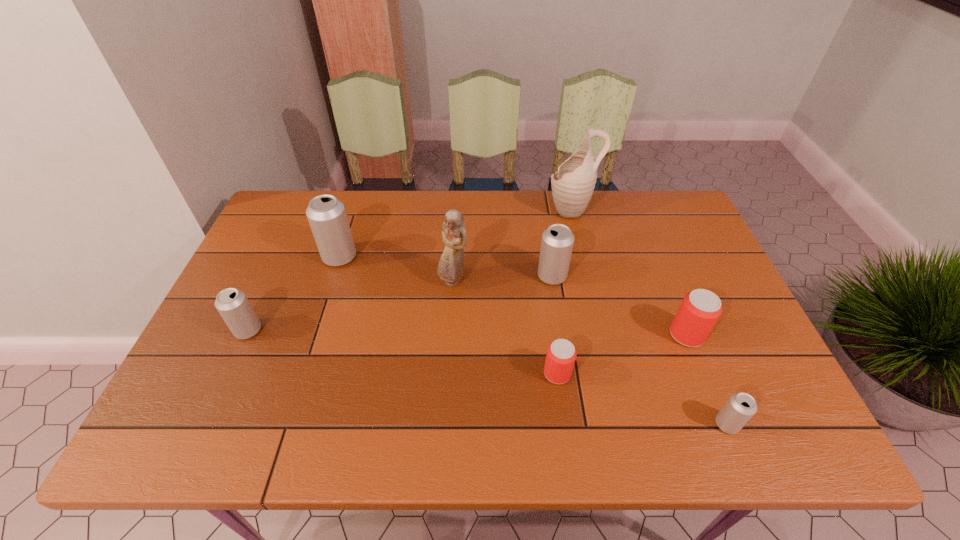
You are a GUI agent. You are given a task and a screenshot of the screen. Output one action in this format:
    pyautogui.click(x=<x>, y=<y>)
    Task: Click on the farthest object
    
    Given the screenshot: What is the action you would take?
    pyautogui.click(x=573, y=184)

At what (x,y) coordinates should I click in order to perform the action: click on pitcher. Please return your answer as a coordinate pair (x, y). This screenshot has height=540, width=960. Looking at the image, I should click on (573, 184).

Where is `the second tallest object`? The image size is (960, 540). the second tallest object is located at coordinates (451, 265).

Image resolution: width=960 pixels, height=540 pixels. Identify the location of figurine. (451, 265).

The height and width of the screenshot is (540, 960). I want to click on the second white beer can from left to right, so click(327, 217).

At what (x,y) coordinates should I click in order to perform the action: click on the biggest white beer can. Please return your answer as a coordinate pair (x, y). The width and height of the screenshot is (960, 540). Looking at the image, I should click on (327, 217).

Where is `the third white beer can from left to right`? The height and width of the screenshot is (540, 960). the third white beer can from left to right is located at coordinates (557, 242).

Identify the location of the fifth shortest beer can. (557, 242).

The width and height of the screenshot is (960, 540). In order to click on the bigger red beer can in this screenshot , I will do `click(700, 309)`.

This screenshot has width=960, height=540. In order to click on the right red beer can in this screenshot , I will do `click(700, 309)`.